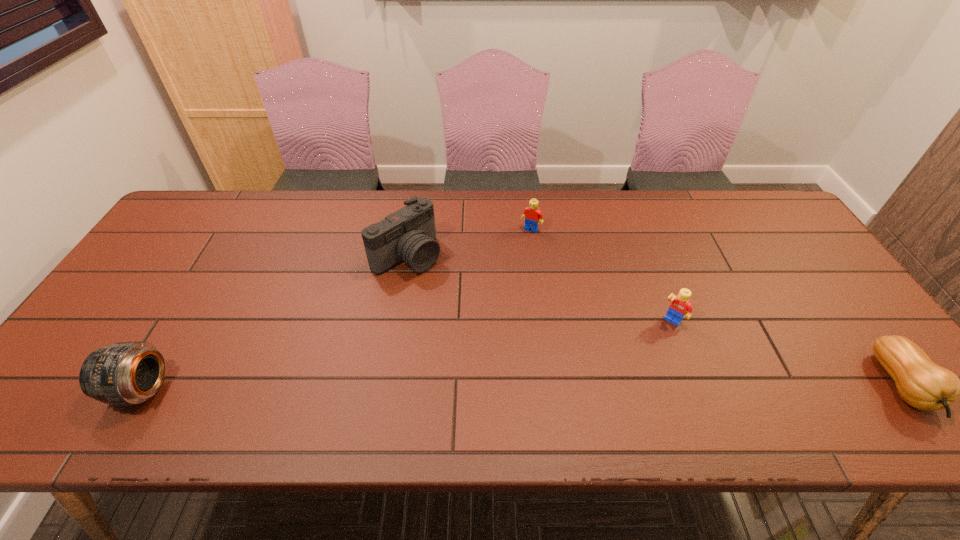
I want to click on vacant space at the left edge of the desktop, so click(153, 284).

Where is `free location at the right edge`? free location at the right edge is located at coordinates (822, 285).

Find the location of a particular element. free location at the far right corner is located at coordinates (782, 218).

I want to click on blank region between the gourd and the second object from left to right, so click(655, 321).

Identify the location of empty location between the leftmost object and the farther Lego. (336, 309).

Where is `vacant area that lies between the gourd and the fourth object from right to left`? The image size is (960, 540). vacant area that lies between the gourd and the fourth object from right to left is located at coordinates (655, 321).

Identify the location of free spot between the farthest object and the rightmost object. The height and width of the screenshot is (540, 960). (716, 307).

I want to click on blank region between the fourth object from right to left and the telephoto lens, so click(x=275, y=322).

Where is `vacant point located between the telephoto lens and the farther Lego`? The width and height of the screenshot is (960, 540). vacant point located between the telephoto lens and the farther Lego is located at coordinates (336, 309).

At what (x,y) coordinates should I click in order to perform the action: click on free spot between the nearer Lego and the farther Lego. Please return your answer as a coordinate pair (x, y). Looking at the image, I should click on (601, 275).